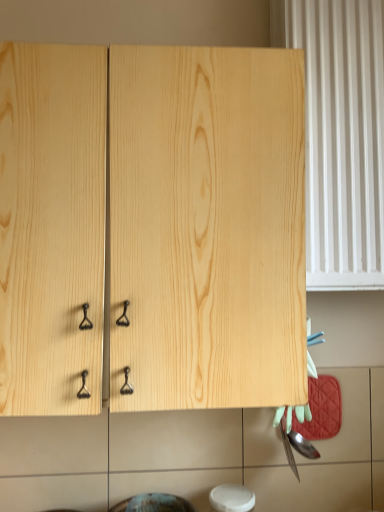
Question: Is natural wood cabinet at center taller or shorter than white plastic radiator at right?

Choices:
 (A) short
 (B) tall

Answer: (A)

Question: Relative to white plastic radiator at right, is natural wood cabinet at center in front or behind?

Choices:
 (A) front
 (B) behind

Answer: (A)

Question: From a real-world perspective, is natural wood cabinet at center positioned above or below white plastic radiator at right?

Choices:
 (A) above
 (B) below

Answer: (B)

Question: Considering the positions of white plastic radiator at right and natural wood cabinet at center in the image, is white plastic radiator at right bigger or smaller than natural wood cabinet at center?

Choices:
 (A) small
 (B) big

Answer: (A)

Question: Visually, is white plastic radiator at right positioned to the left or to the right of natural wood cabinet at center?

Choices:
 (A) right
 (B) left

Answer: (A)

Question: Is point (367, 246) closer or farther from the camera than point (21, 204)?

Choices:
 (A) farther
 (B) closer

Answer: (A)

Question: Considering their positions, is white plastic radiator at right located in front of or behind natural wood cabinet at center?

Choices:
 (A) behind
 (B) front

Answer: (A)